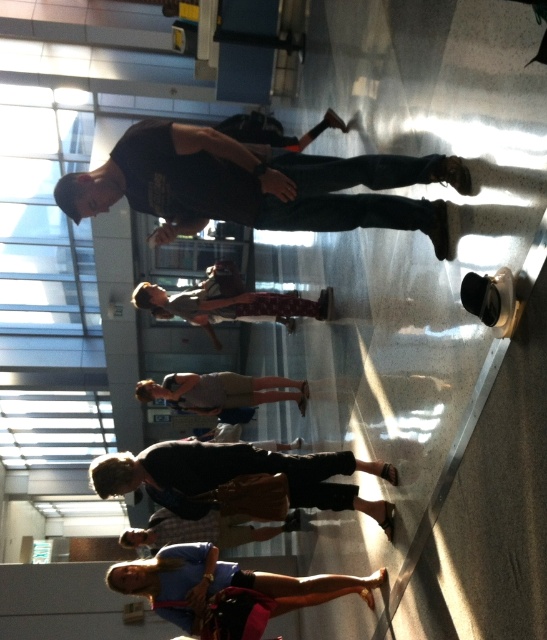
You are observing two people standing in the center of a bright indoor area with reflective floors. Both are wearing dark clothing. The first person is wearing dark blue jeans at center, and the second is wearing a dark gray fabric skater at center. Based on the scene description, which clothing item is positioned higher on their respective bodies?

The dark blue jeans at center is located above the dark gray fabric skater at center, so the dark blue jeans at center is positioned higher on the body.

You are a photographer setting up a shoot in this space. You need to place a small tripod between the dark blue jeans at center and the denim shorts at lower center. Given that the tripod requires at least 30 cm of space between the two objects to be safely placed, can you determine if there is enough space based on their widths?

The dark blue jeans at center has a larger width than the denim shorts at lower center, but the exact distance between them isn not provided. Therefore, it is impossible to determine if there is enough space for the tripod.